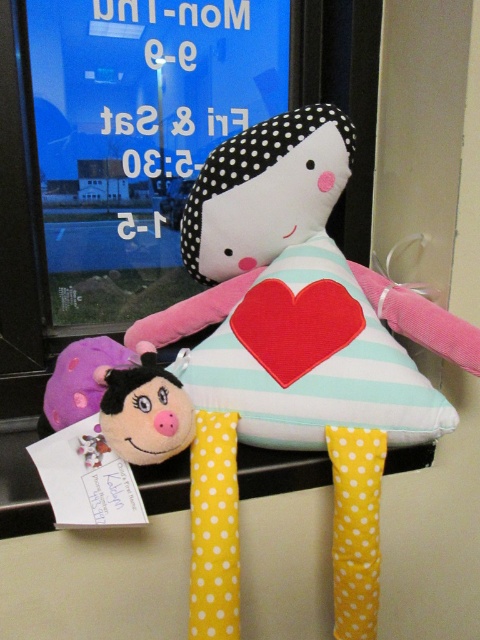
Question: Which point is closer to the camera taking this photo?

Choices:
 (A) (140, 429)
 (B) (391, 324)

Answer: (A)

Question: Which point is closer to the camera taking this photo?

Choices:
 (A) (216, 285)
 (B) (175, 417)

Answer: (B)

Question: Considering the relative positions of soft fabric rag doll with heart at center and fluffy pink plush at lower left in the image provided, where is soft fabric rag doll with heart at center located with respect to fluffy pink plush at lower left?

Choices:
 (A) below
 (B) above

Answer: (B)

Question: Is soft fabric rag doll with heart at center in front of fluffy pink plush at lower left?

Choices:
 (A) no
 (B) yes

Answer: (A)

Question: Considering the relative positions of soft fabric rag doll with heart at center and fluffy pink plush at lower left in the image provided, where is soft fabric rag doll with heart at center located with respect to fluffy pink plush at lower left?

Choices:
 (A) above
 (B) below

Answer: (A)